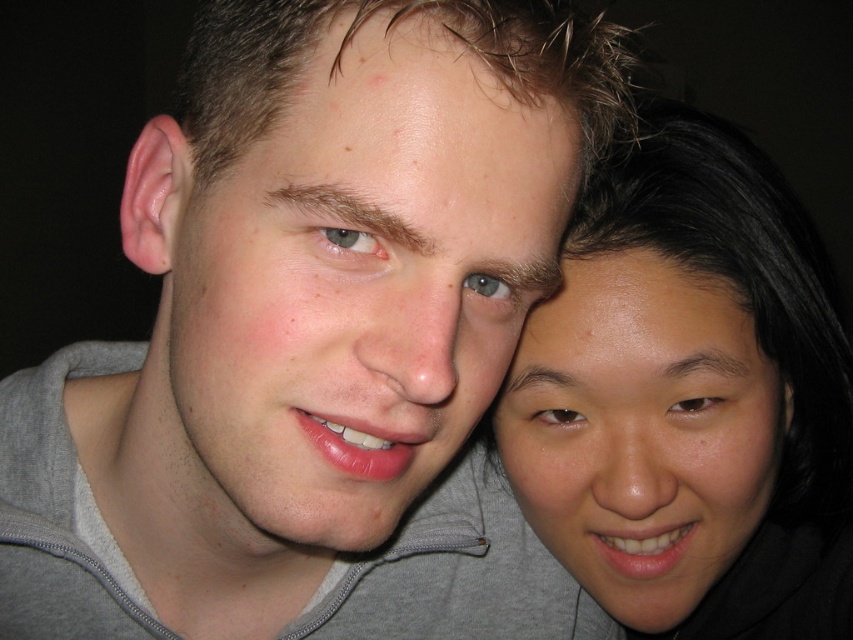
Question: Can you confirm if matte gray hoodie at center is positioned above smooth skin face at right?

Choices:
 (A) no
 (B) yes

Answer: (B)

Question: Which is nearer to the smooth skin face at right?

Choices:
 (A) matte gray hoodie at center
 (B) gray hoodie at center

Answer: (A)

Question: Based on their relative distances, which object is farther from the matte gray hoodie at center?

Choices:
 (A) gray hoodie at center
 (B) smooth skin face at right

Answer: (A)

Question: Does matte gray hoodie at center have a larger size compared to smooth skin face at right?

Choices:
 (A) yes
 (B) no

Answer: (A)

Question: Is matte gray hoodie at center wider than gray hoodie at center?

Choices:
 (A) no
 (B) yes

Answer: (A)

Question: Which object is positioned closest to the gray hoodie at center?

Choices:
 (A) smooth skin face at right
 (B) matte gray hoodie at center

Answer: (A)